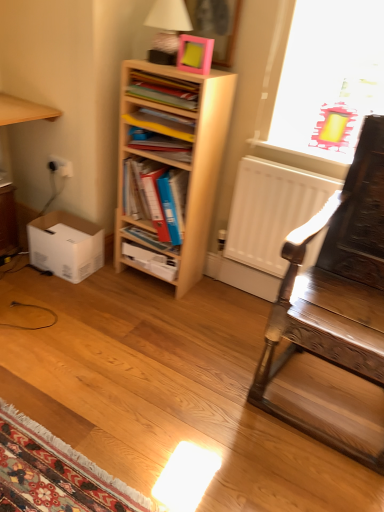
Locate an element on the screen. Image resolution: width=384 pixels, height=512 pixels. free region under white matte radiator at center (from a real-world perspective) is located at coordinates (249, 293).